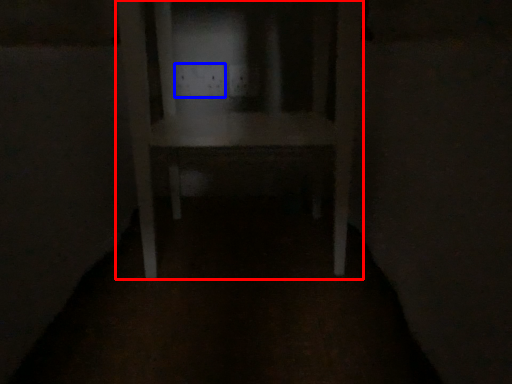
Question: Among these objects, which one is farthest to the camera, furniture (highlighted by a red box) or electric outlet (highlighted by a blue box)?

Choices:
 (A) furniture
 (B) electric outlet

Answer: (B)